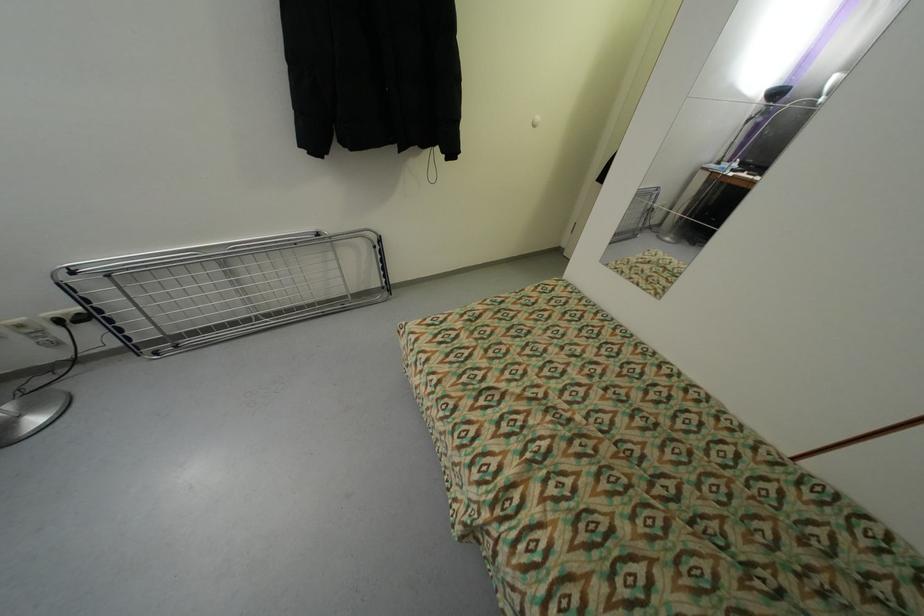
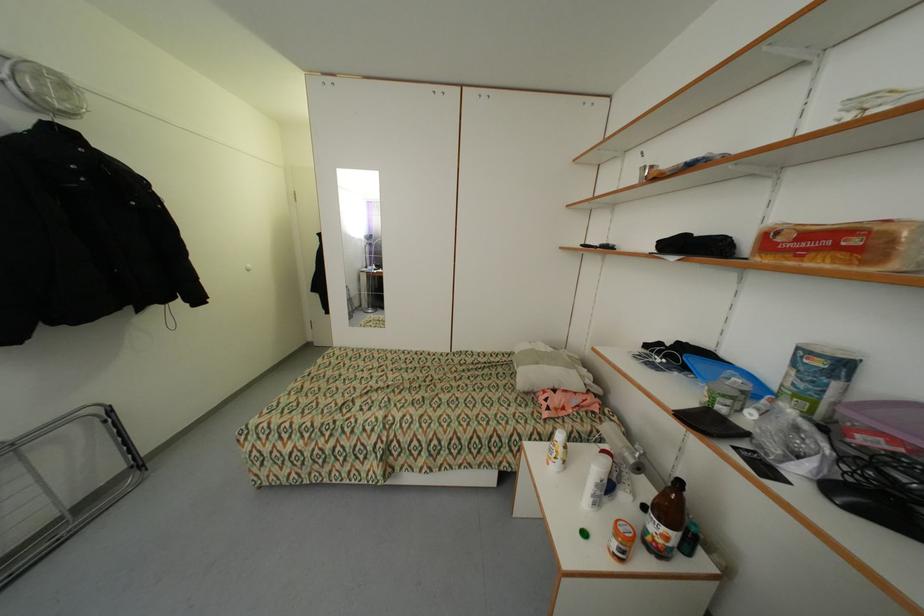
Locate, in the second image, the point that corresponds to [381,248] in the first image.

(112, 422)